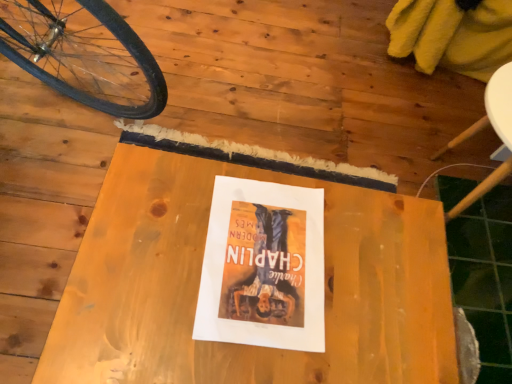
You are a GUI agent. You are given a task and a screenshot of the screen. Output one action in this format:
    pyautogui.click(x=<x>, y=<y>)
    Task: Click on the free space below white paper at center (from a real-world perspective)
    
    Given the screenshot: What is the action you would take?
    pyautogui.click(x=259, y=259)